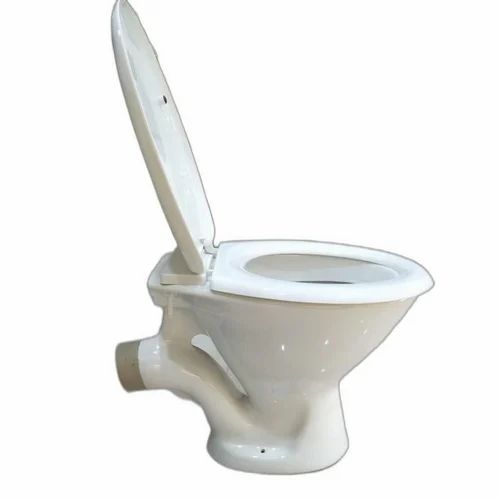
Where is `empty space right of toilet`? empty space right of toilet is located at coordinates (423, 400).